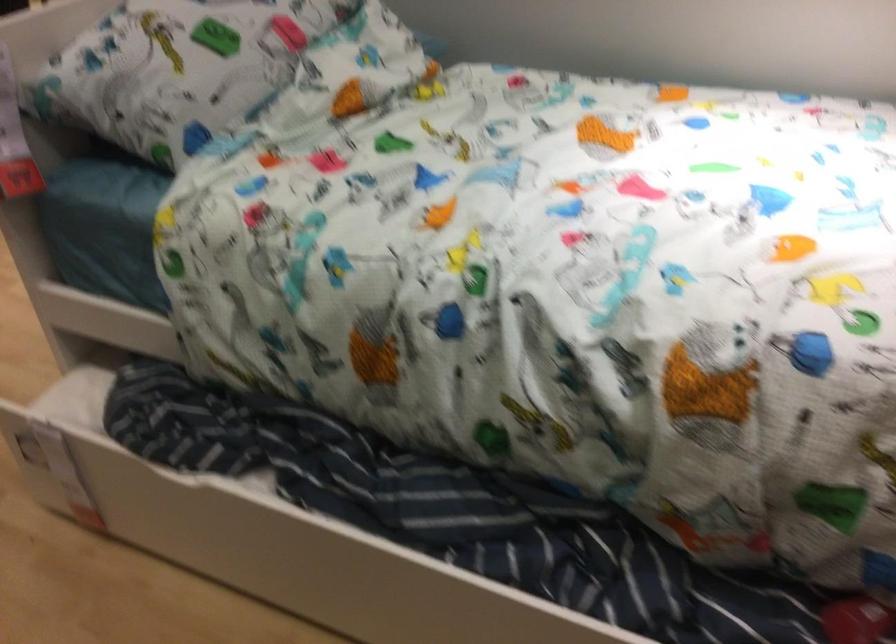
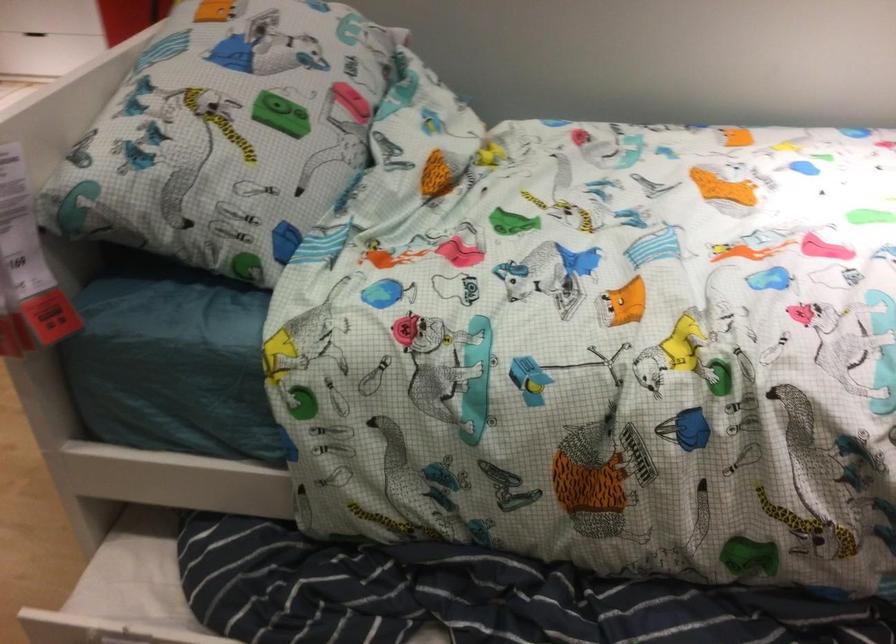
In a continuous first-person perspective shot, in which direction is the camera moving?

The cameraman moved toward left, forward.